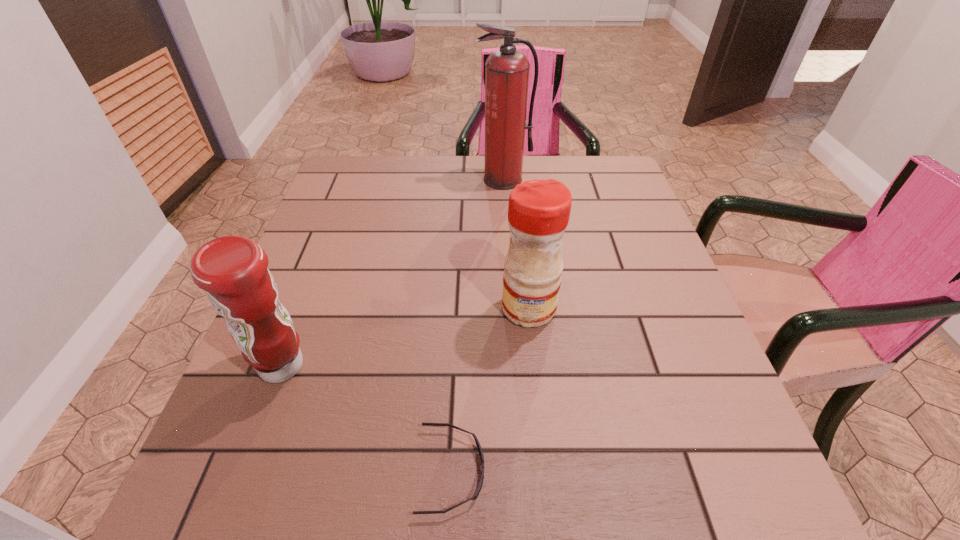
Identify which object is located as the second nearest to the tallest object. Please provide its 2D coordinates. Your answer should be formatted as a tuple, i.e. [(x, y)], where the tuple contains the x and y coordinates of a point satisfying the conditions above.

[(233, 271)]

This screenshot has width=960, height=540. Identify the location of free space in the image that satisfies the following two spatial constraints: 1. at the nozzle of the fire extinguisher; 2. on the front-facing side of the sunglasses. tap(525, 470).

At what (x,y) coordinates should I click in order to perform the action: click on free space that satisfies the following two spatial constraints: 1. at the nozzle of the right condiment; 2. on the right side of the tallest object. Please return your answer as a coordinate pair (x, y). The width and height of the screenshot is (960, 540). Looking at the image, I should click on (513, 308).

Locate an element on the screen. free point that satisfies the following two spatial constraints: 1. at the nozzle of the farthest object; 2. on the front-facing side of the sunglasses is located at coordinates (525, 470).

You are a GUI agent. You are given a task and a screenshot of the screen. Output one action in this format:
    pyautogui.click(x=<x>, y=<y>)
    Task: Click on the vacant point that satisfies the following two spatial constraints: 1. at the nozzle of the second farthest object; 2. on the right side of the fire extinguisher
    
    Given the screenshot: What is the action you would take?
    pyautogui.click(x=513, y=308)

Where is `free space that satisfies the following two spatial constraints: 1. at the nozzle of the fire extinguisher; 2. on the front-facing side of the shortest object`? free space that satisfies the following two spatial constraints: 1. at the nozzle of the fire extinguisher; 2. on the front-facing side of the shortest object is located at coordinates (525, 470).

What are the coordinates of `vacant space that satisfies the following two spatial constraints: 1. at the nozzle of the farthest object; 2. on the front-facing side of the nearest object` in the screenshot? It's located at (525, 470).

The image size is (960, 540). I want to click on free space that satisfies the following two spatial constraints: 1. at the nozzle of the second farthest object; 2. on the left side of the farthest object, so click(513, 308).

Find the location of a particular element. The width and height of the screenshot is (960, 540). vacant region that satisfies the following two spatial constraints: 1. at the nozzle of the second farthest object; 2. on the right side of the farthest object is located at coordinates (513, 308).